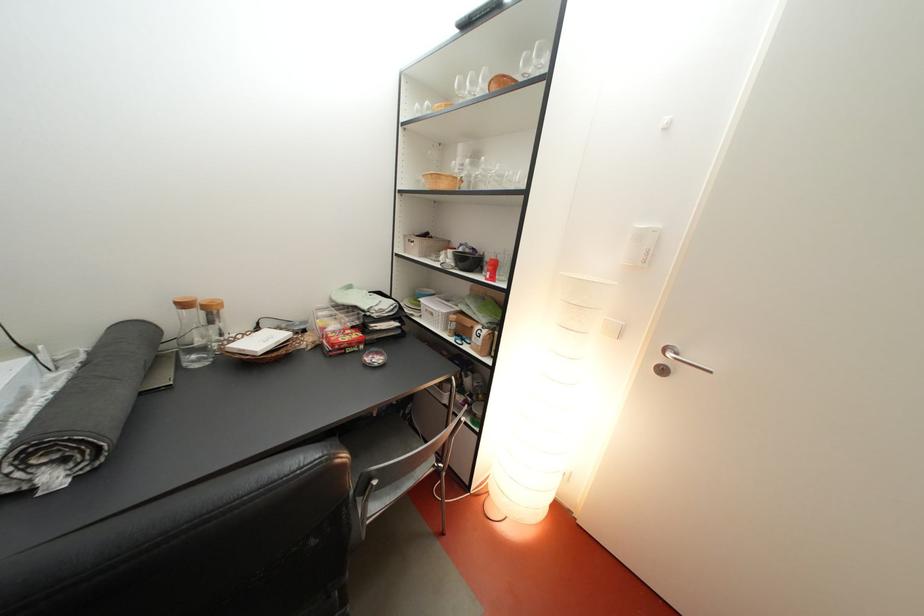
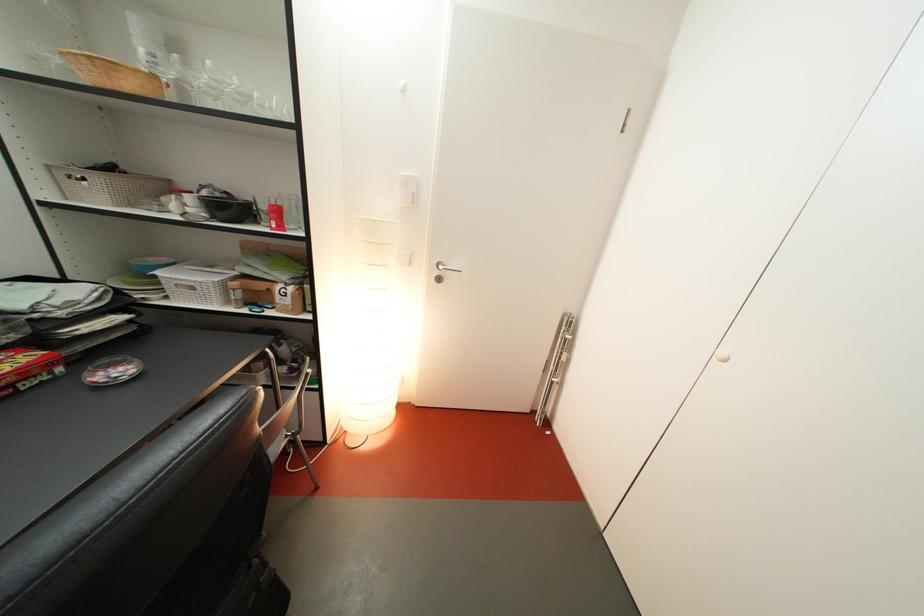
In the second image, find the point that corresponds to the point at 444,321 in the first image.

(204, 294)